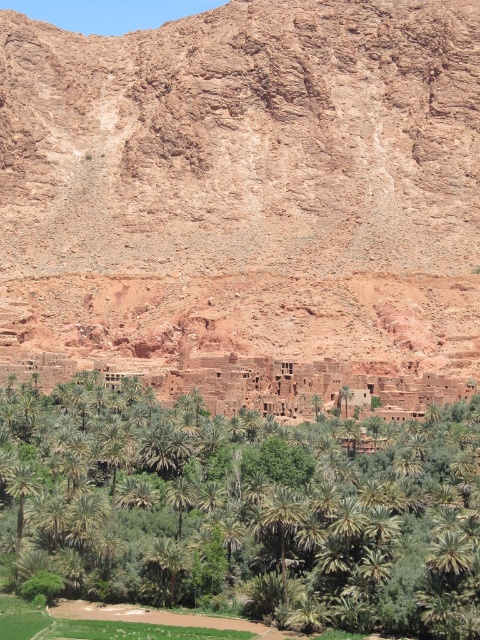
You are planning to set up a small tent in this landscape. Considering the brown rock formation at center and the green leafy palm at center, which object would provide better shelter from the sun if you place your tent behind it?

The brown rock formation at center is bigger than the green leafy palm at center, so placing the tent behind the brown rock formation at center would provide better shelter from the sun.

Consider the image. You are standing in the oasis and want to walk from the green leafy palm tree at lower left to the green leafy palm at center. Which direction should you head?

You should head to the right to reach the green leafy palm at center from the green leafy palm tree at lower left, as it is positioned to the right of it.